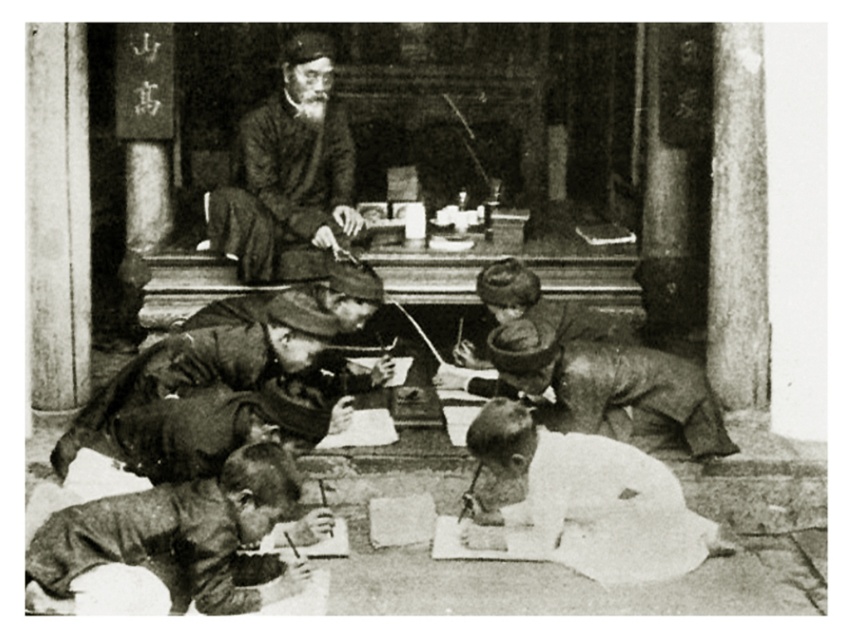
You are a photographer observing this historical scene. You notice the smooth brown jacket at lower left and the dark brown textured robe at center. Which clothing item appears shorter in height?

The smooth brown jacket at lower left is not as tall as the dark brown textured robe at center, so the smooth brown jacket at lower left appears shorter in height.

You are a teacher observing a historical outdoor lesson. You notice the white paper at lower center and the smooth stone pillar at right. Which object is wider?

The white paper at lower center might be wider than smooth stone pillar at right.

A teacher wants to place a small stool between the white paper at lower center and the smooth stone pillar at right for a student. The stool is 0.5 meters wide. Is there enough space between them to fit the stool?

The distance between the white paper at lower center and the smooth stone pillar at right is 2.64 meters. Since the stool is only 0.5 meters wide, there is ample space to place it between them.